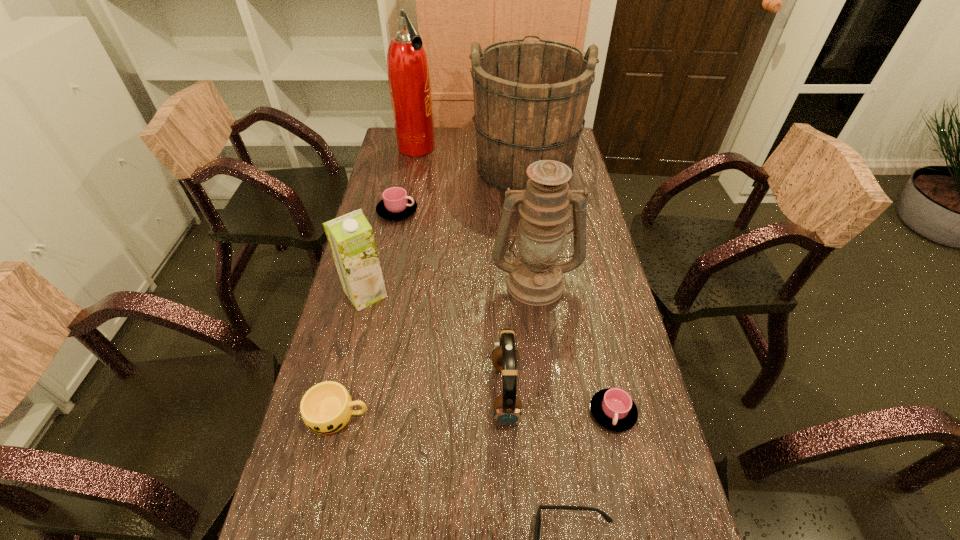
At what (x,y) coordinates should I click in order to perform the action: click on object at the far right corner. Please return your answer as a coordinate pair (x, y). Looking at the image, I should click on (530, 97).

Image resolution: width=960 pixels, height=540 pixels. Find the location of `vacant area at the left edge`. vacant area at the left edge is located at coordinates (357, 459).

Image resolution: width=960 pixels, height=540 pixels. Identify the location of vacant space at the right edge of the desktop. (572, 291).

Where is `empty location between the green soya milk and the headset`? The height and width of the screenshot is (540, 960). empty location between the green soya milk and the headset is located at coordinates (436, 343).

At what (x,y) coordinates should I click in order to perform the action: click on vacant area that lies between the fourth tallest object and the beige cup. Please return your answer as a coordinate pair (x, y). Looking at the image, I should click on (352, 355).

Where is `blank region between the nearer pink cup and the beige cup`? blank region between the nearer pink cup and the beige cup is located at coordinates 475,414.

Image resolution: width=960 pixels, height=540 pixels. I want to click on free area in between the oil lamp and the headset, so (x=520, y=337).

I want to click on free space that is in between the headset and the red fire extinguisher, so click(461, 271).

At what (x,y) coordinates should I click in order to perform the action: click on vacant space in between the oil lamp and the headset. Please return your answer as a coordinate pair (x, y). Looking at the image, I should click on (520, 337).

Identify the location of unoccupied area between the oil lamp and the brown headset. (520, 337).